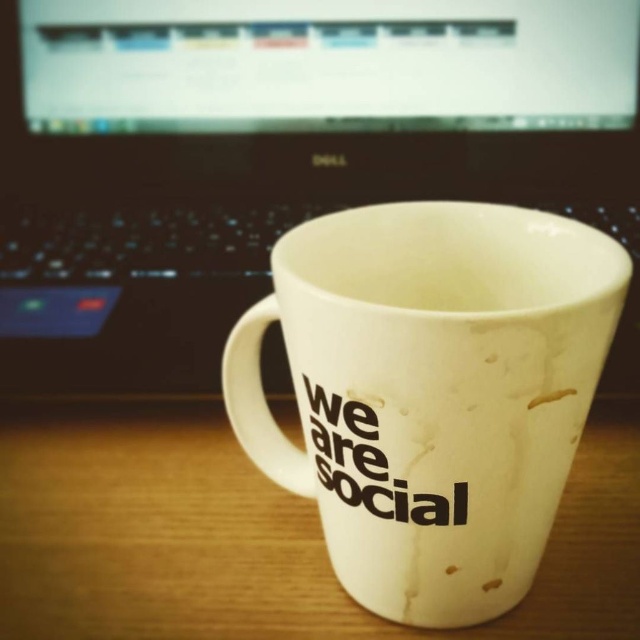
You are setting up a small desk area and want to place the white matte mug at center on the white matte wood table at center. Based on their sizes, will the mug fit on the table without hanging over the edges?

The white matte mug at center is taller than the white matte wood table at center. Since the mug is taller, it might extend above the table but not necessarily hang over the edges horizontally. However, the description does not provide information about the table width or mug diameter, so we cannot confirm if it will fit without overhanging.

You are organizing your desk and want to place a new mug exactly where the black plastic laptop at center is currently located. Based on the image, can you determine the exact coordinates where you should place the new mug?

The black plastic laptop at center is located at coordinates point (276,156), so you should place the new mug at those exact coordinates.

You need to place a large dictionary on your desk. The dictionary is bigger than the black plastic laptop at center. Will it fit on the white matte wood table at center?

The black plastic laptop at center is larger than the white matte wood table at center. Since the dictionary is bigger than the laptop, it will not fit on the table.